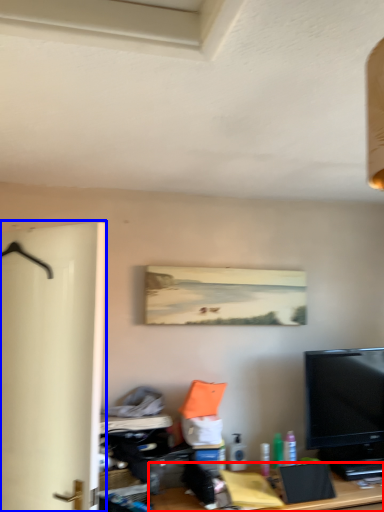
Question: Among these objects, which one is farthest to the camera, desk (highlighted by a red box) or door (highlighted by a blue box)?

Choices:
 (A) desk
 (B) door

Answer: (A)